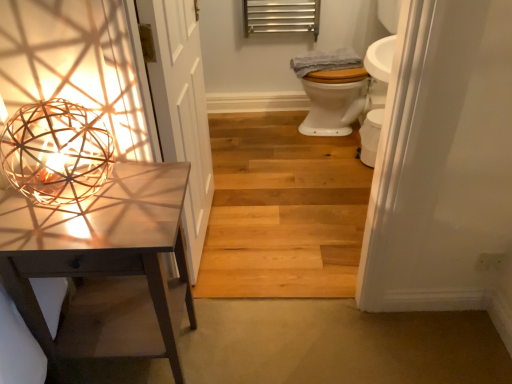
This screenshot has width=512, height=384. Identify the location of free space above matte white table at left (from a real-world perspective). (97, 205).